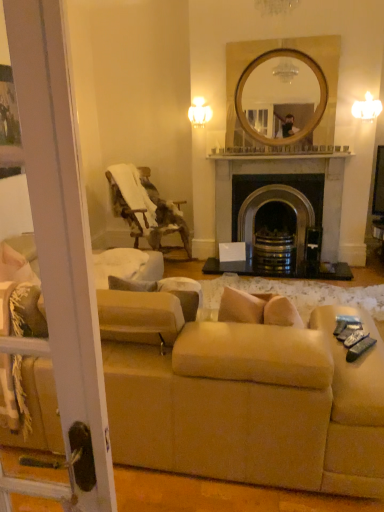
What do you see at coordinates (283, 203) in the screenshot? I see `black stone fireplace at center` at bounding box center [283, 203].

At what (x,y) coordinates should I click in order to perform the action: click on beige fabric couch at lower center. Please return your answer as a coordinate pair (x, y). The height and width of the screenshot is (512, 384). Looking at the image, I should click on coord(241,398).

The width and height of the screenshot is (384, 512). Identify the location of black stone fireplace at center. (283, 203).

Which object is wider, black stone fireplace at center or beige fabric couch at lower center?

beige fabric couch at lower center.

Which object is further away from the camera, black stone fireplace at center or beige fabric couch at lower center?

black stone fireplace at center is more distant.

Could you tell me if black stone fireplace at center is facing beige fabric couch at lower center?

Yes, black stone fireplace at center is turned towards beige fabric couch at lower center.

Considering the relative sizes of wooden textured chair at left and beige fabric couch at lower center in the image provided, is wooden textured chair at left shorter than beige fabric couch at lower center?

Incorrect, the height of wooden textured chair at left does not fall short of that of beige fabric couch at lower center.

Is wooden textured chair at left not near beige fabric couch at lower center?

Indeed, wooden textured chair at left is not near beige fabric couch at lower center.

You are a GUI agent. You are given a task and a screenshot of the screen. Output one action in this format:
    pyautogui.click(x=<x>, y=<y>)
    Task: Click on the studio couch lying below the wooden textured chair at left (from the image's perspective)
    This screenshot has height=512, width=384.
    Given the screenshot: What is the action you would take?
    pyautogui.click(x=241, y=398)

Is black stone fireplace at center to the right of wooden textured chair at left from the viewer's perspective?

Yes.

Considering the relative sizes of black stone fireplace at center and wooden textured chair at left in the image provided, is black stone fireplace at center wider than wooden textured chair at left?

No, black stone fireplace at center is not wider than wooden textured chair at left.

You are a GUI agent. You are given a task and a screenshot of the screen. Output one action in this format:
    pyautogui.click(x=<x>, y=<y>)
    Task: Click on the chair located underneath the black stone fireplace at center (from a real-world perspective)
    
    Given the screenshot: What is the action you would take?
    pyautogui.click(x=145, y=207)

Measure the distance from black stone fireplace at center to wooden textured chair at left.

black stone fireplace at center is 38.78 inches away from wooden textured chair at left.

There is a wooden textured chair at left. In order to click on fireplace above it (from a real-world perspective) in this screenshot , I will do `click(283, 203)`.

Which object is more forward, wooden textured chair at left or black stone fireplace at center?

wooden textured chair at left is closer to the camera.

From a real-world perspective, is wooden textured chair at left above or below black stone fireplace at center?

From a real-world perspective, wooden textured chair at left is physically below black stone fireplace at center.

Is wooden textured chair at left positioned with its back to black stone fireplace at center?

No, wooden textured chair at left's orientation is not away from black stone fireplace at center.

Which point is more distant from viewer, (112, 386) or (136, 215)?

The point (136, 215) is behind.

From a real-world perspective, which is physically above, beige fabric couch at lower center or wooden textured chair at left?

From a 3D spatial view, wooden textured chair at left is above.

Is beige fabric couch at lower center bigger or smaller than wooden textured chair at left?

Considering their sizes, beige fabric couch at lower center takes up more space than wooden textured chair at left.

Is beige fabric couch at lower center surrounding wooden textured chair at left?

No.

From a real-world perspective, who is located higher, beige fabric couch at lower center or black stone fireplace at center?

From a 3D spatial view, black stone fireplace at center is above.

From the image's perspective, which one is positioned higher, beige fabric couch at lower center or black stone fireplace at center?

black stone fireplace at center, from the image's perspective.

Is beige fabric couch at lower center closer to the viewer compared to black stone fireplace at center?

Yes, the depth of beige fabric couch at lower center is less than that of black stone fireplace at center.

Can you confirm if beige fabric couch at lower center is smaller than black stone fireplace at center?

No, beige fabric couch at lower center is not smaller than black stone fireplace at center.

Locate an element on the screen. The height and width of the screenshot is (512, 384). studio couch in front of the black stone fireplace at center is located at coordinates (241, 398).

Identify the location of chair above the beige fabric couch at lower center (from the image's perspective). (145, 207).

Looking at the image, which one is located closer to beige fabric couch at lower center, wooden textured chair at left or black stone fireplace at center?

The object closer to beige fabric couch at lower center is black stone fireplace at center.

When comparing their distances from beige fabric couch at lower center, does black stone fireplace at center or wooden textured chair at left seem closer?

black stone fireplace at center is positioned closer to the anchor beige fabric couch at lower center.

Considering their positions, is black stone fireplace at center positioned closer to wooden textured chair at left than beige fabric couch at lower center?

black stone fireplace at center is closer to wooden textured chair at left.

Looking at the image, which one is located further to black stone fireplace at center, beige fabric couch at lower center or wooden textured chair at left?

The object further to black stone fireplace at center is beige fabric couch at lower center.

Looking at the image, which one is located closer to wooden textured chair at left, beige fabric couch at lower center or black stone fireplace at center?

Based on the image, black stone fireplace at center appears to be nearer to wooden textured chair at left.

Which object lies further to the anchor point black stone fireplace at center, wooden textured chair at left or beige fabric couch at lower center?

beige fabric couch at lower center lies further to black stone fireplace at center than the other object.

Find the location of `chair located between beige fabric couch at lower center and black stone fireplace at center in the depth direction`. chair located between beige fabric couch at lower center and black stone fireplace at center in the depth direction is located at coordinates [x=145, y=207].